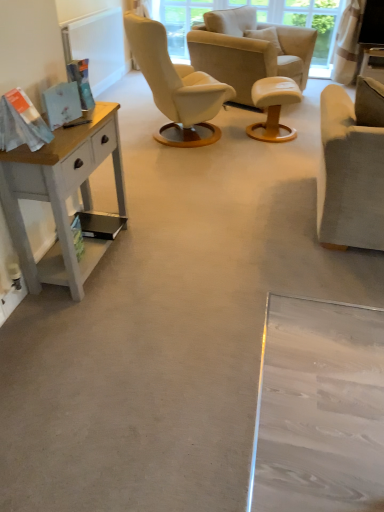
Question: Relative to suede beige armchair at center, the first chair when ordered from top to bottom, is white leather stool at center in front or behind?

Choices:
 (A) front
 (B) behind

Answer: (A)

Question: Is point (261, 101) positioned closer to the camera than point (233, 53)?

Choices:
 (A) closer
 (B) farther

Answer: (A)

Question: Considering the real-world distances, which object is closest to the white leather stool at center?

Choices:
 (A) suede beige armchair at center, which appears as the 2th chair when viewed from the front
 (B) suede beige armchair at right, the first chair viewed from the front
 (C) matte white side table at upper right
 (D) white painted wood desk at left

Answer: (A)

Question: Considering the real-world distances, which object is farthest from the white leather stool at center?

Choices:
 (A) matte white side table at upper right
 (B) suede beige armchair at center, acting as the second chair starting from the bottom
 (C) white painted wood desk at left
 (D) suede beige armchair at right, the second chair in the top-to-bottom sequence

Answer: (C)